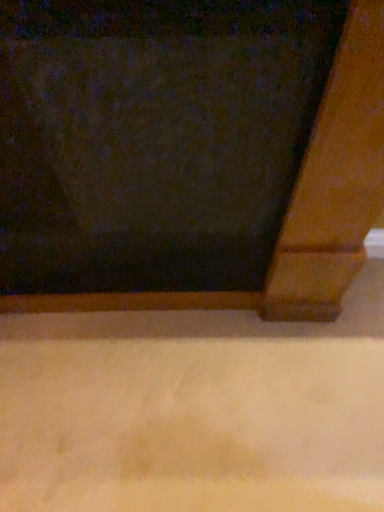
Where is `vacant area that is in front of matte wood frame at lower right`? The width and height of the screenshot is (384, 512). vacant area that is in front of matte wood frame at lower right is located at coordinates (180, 418).